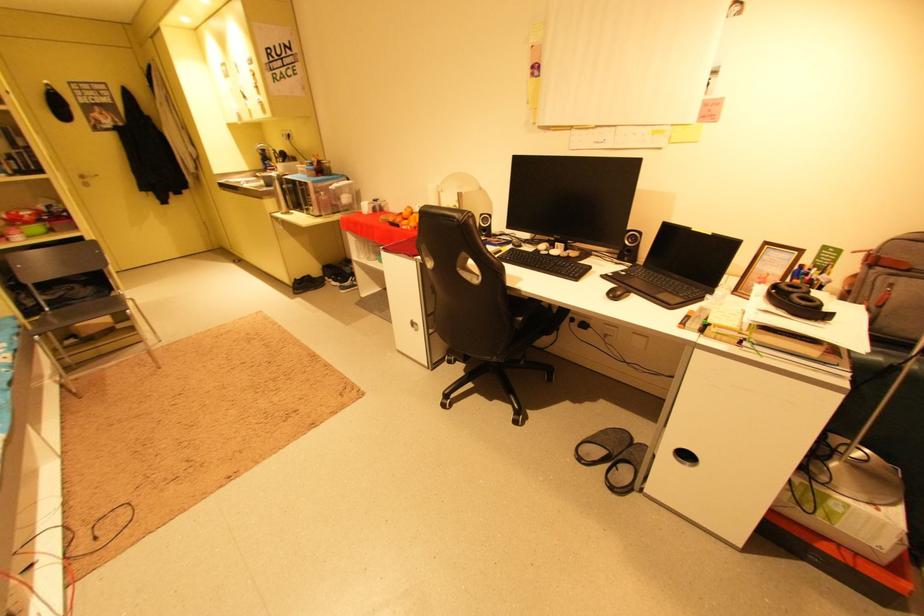
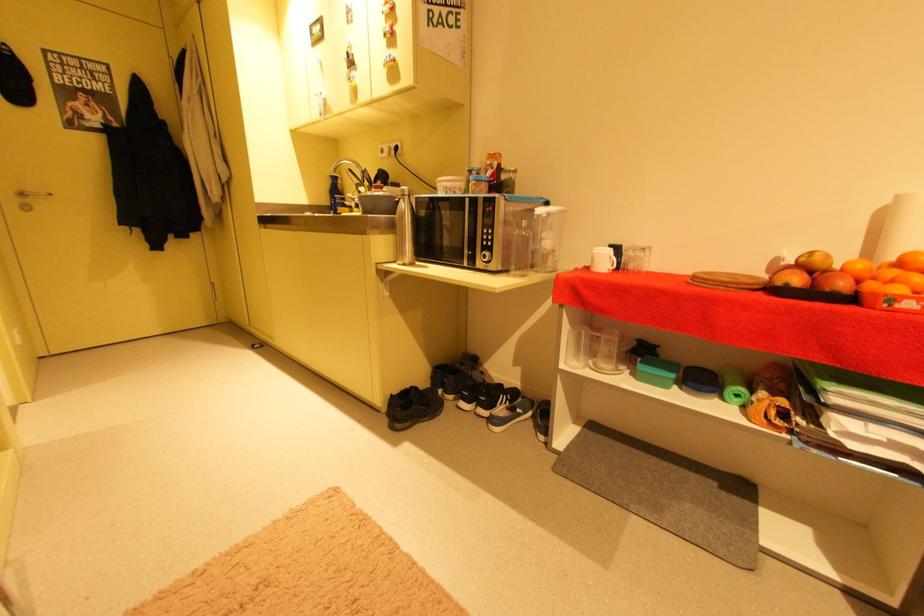
What movement of the cameraman would produce the second image?

The cameraman moved toward left, forward.